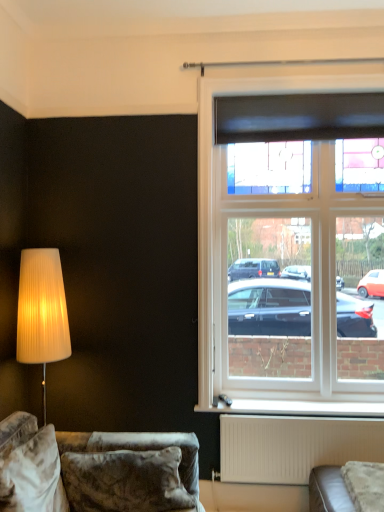
Identify the location of vacant region under stained glass window at upper right (from a real-world perspective). (301, 404).